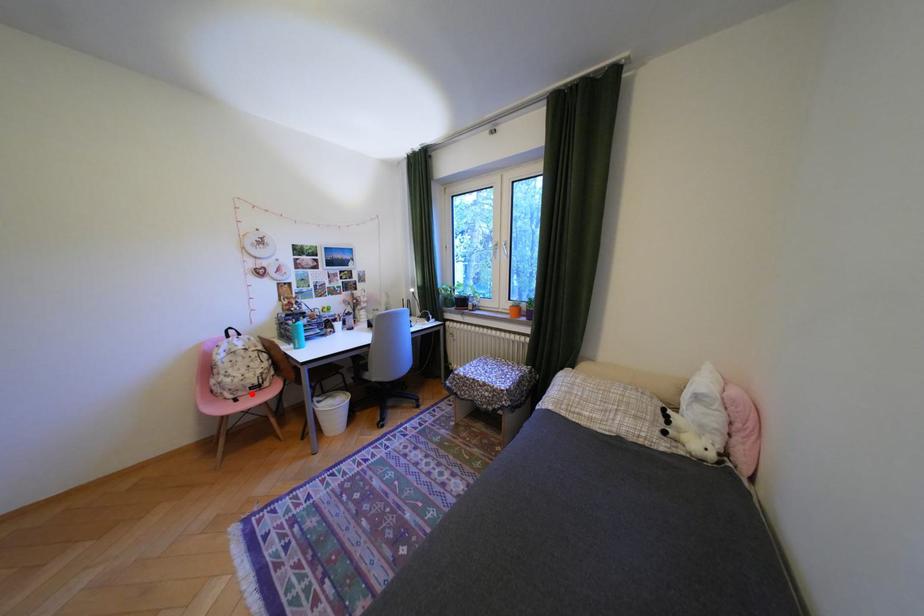
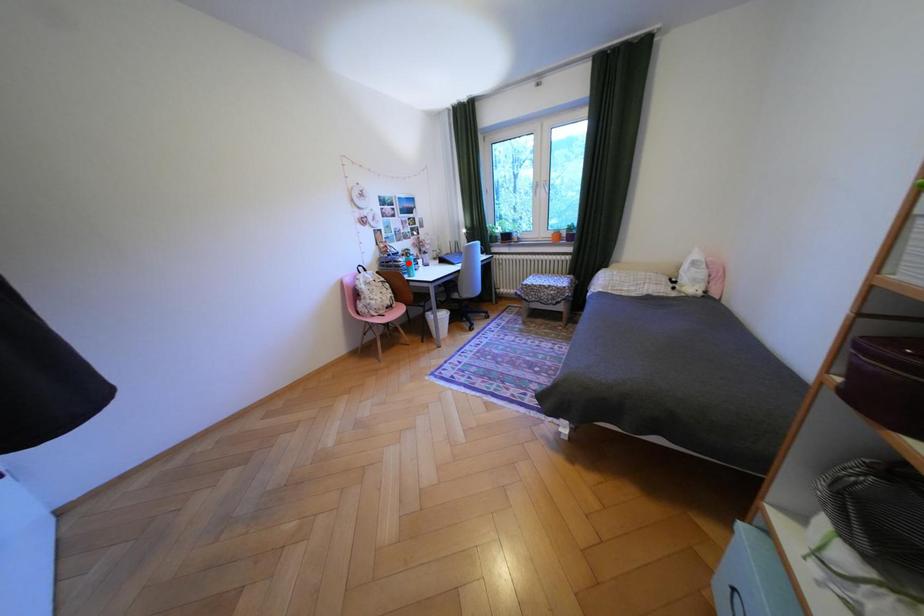
Looking at this image, I am providing you with two images of the same scene from different viewpoints. A red point is marked on the first image and another point is marked on the second image. Is the red point in image1 aligned with the point shown in image2?

No